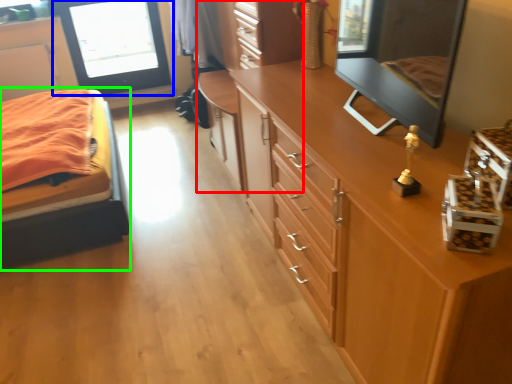
Question: Considering the real-world distances, which object is farthest from dresser (highlighted by a red box)? window screen (highlighted by a blue box) or bed (highlighted by a green box)?

Choices:
 (A) window screen
 (B) bed

Answer: (A)